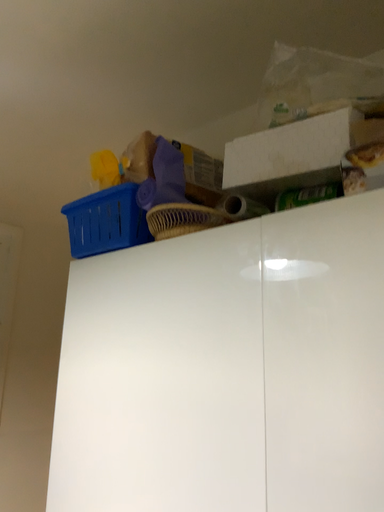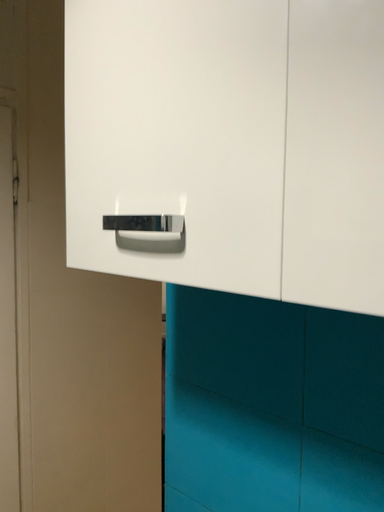
Question: How did the camera likely rotate when shooting the video?

Choices:
 (A) rotated upward
 (B) rotated downward

Answer: (B)